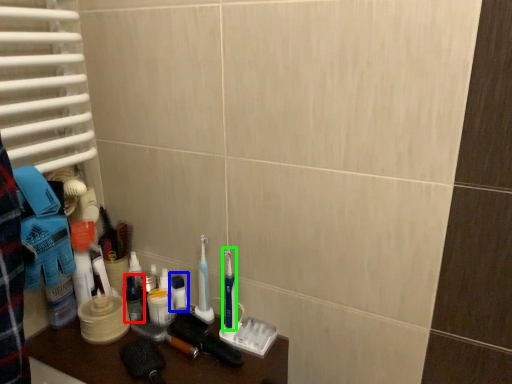
Question: Estimate the real-world distances between objects in this image. Which object is farther from toiletry (highlighted by a red box), toiletry (highlighted by a blue box) or toothbrush (highlighted by a green box)?

Choices:
 (A) toiletry
 (B) toothbrush

Answer: (B)